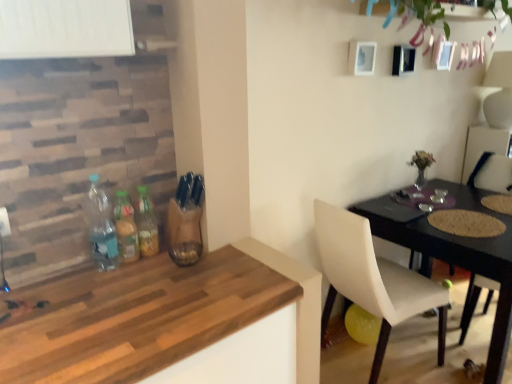
Image resolution: width=512 pixels, height=384 pixels. In order to click on free space in front of translucent plastic bottle at left, which is counted as the second bottle, starting from the left in this screenshot , I will do `click(108, 279)`.